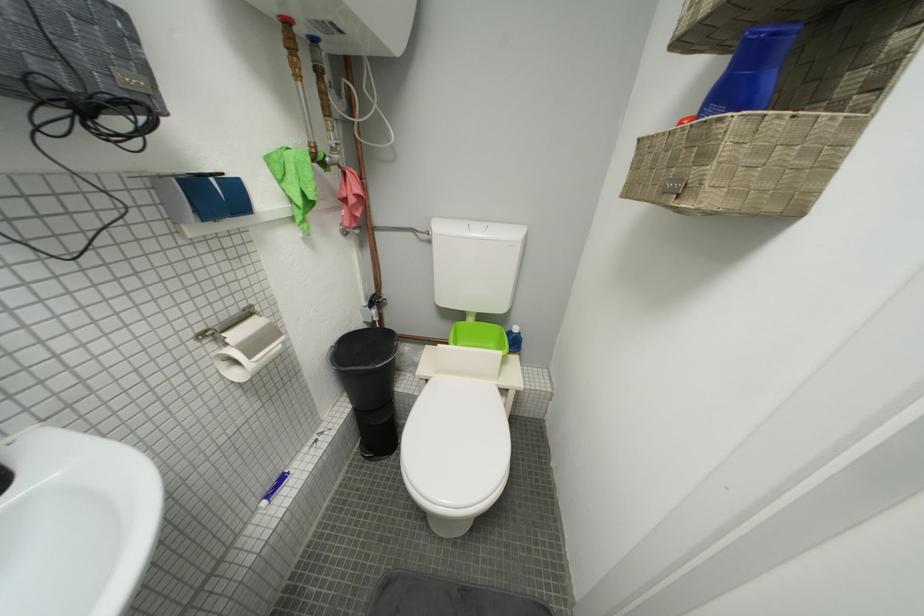
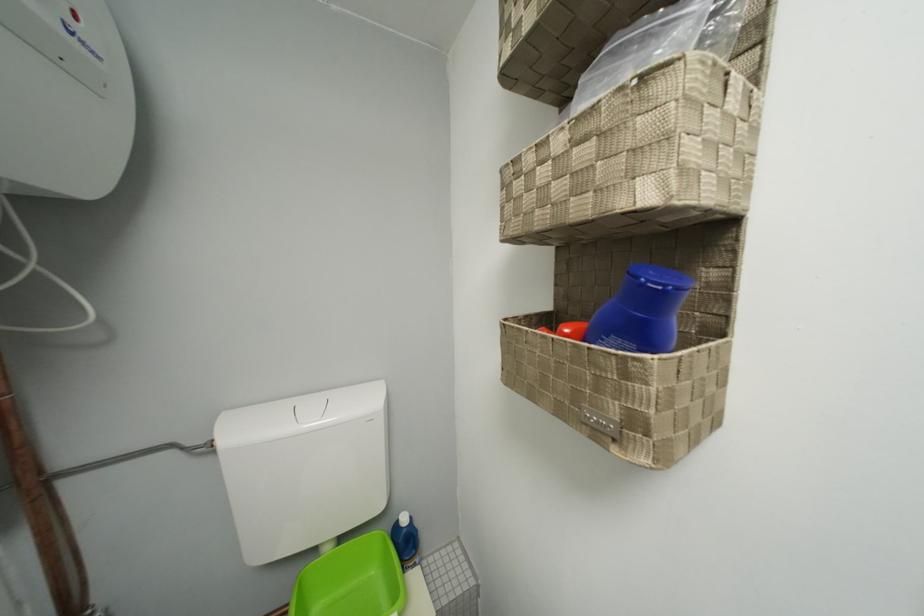
Where in the second image is the point corresponding to point 752,41 from the first image?

(651, 286)